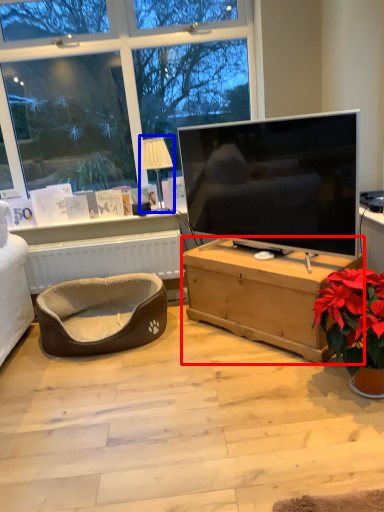
Question: Which of the following is the closest to the observer, desk (highlighted by a red box) or lamp (highlighted by a blue box)?

Choices:
 (A) desk
 (B) lamp

Answer: (A)